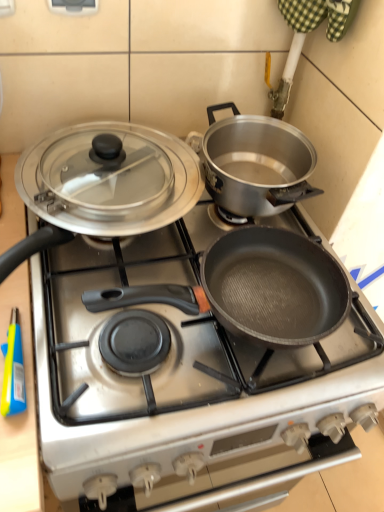
Question: Based on their sizes in the image, would you say non-stick black pan at center is bigger or smaller than shiny silver lid at upper left?

Choices:
 (A) small
 (B) big

Answer: (B)

Question: Does point (230, 457) appear closer or farther from the camera than point (92, 233)?

Choices:
 (A) closer
 (B) farther

Answer: (B)

Question: Would you say non-stick black pan at center is to the left or to the right of shiny silver lid at upper left in the picture?

Choices:
 (A) right
 (B) left

Answer: (A)

Question: In terms of size, does shiny silver lid at upper left appear bigger or smaller than non-stick black pan at center?

Choices:
 (A) big
 (B) small

Answer: (B)

Question: From a real-world perspective, relative to non-stick black pan at center, is shiny silver lid at upper left vertically above or below?

Choices:
 (A) below
 (B) above

Answer: (B)

Question: Is point (193, 199) closer or farther from the camera than point (238, 393)?

Choices:
 (A) closer
 (B) farther

Answer: (B)

Question: Visually, is shiny silver lid at upper left positioned to the left or to the right of non-stick black pan at center?

Choices:
 (A) left
 (B) right

Answer: (A)